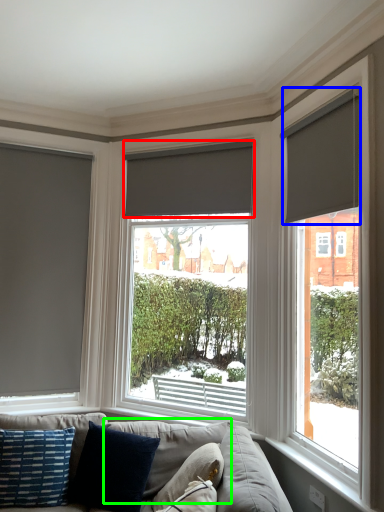
Question: Considering the real-world distances, which object is farthest from window blind (highlighted by a red box)? window blind (highlighted by a blue box) or pillow (highlighted by a green box)?

Choices:
 (A) window blind
 (B) pillow

Answer: (B)